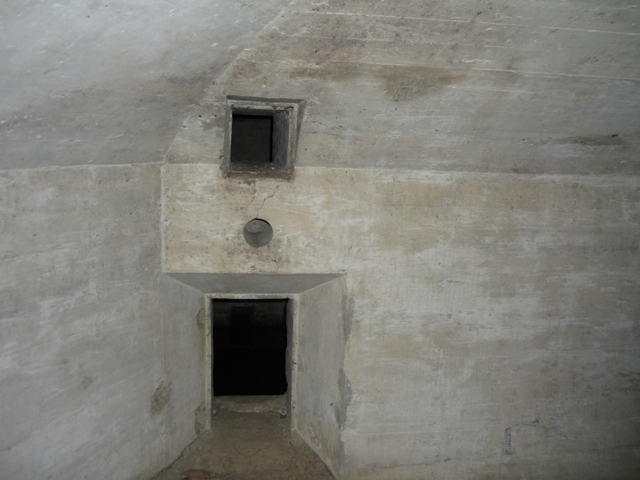
Where is `above the doorway`? This screenshot has width=640, height=480. above the doorway is located at coordinates pos(253,274).